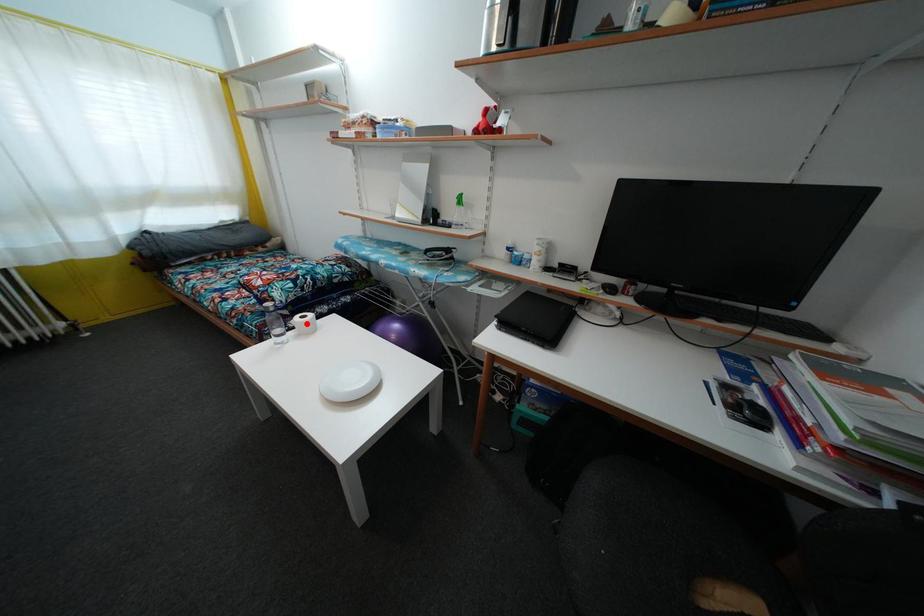
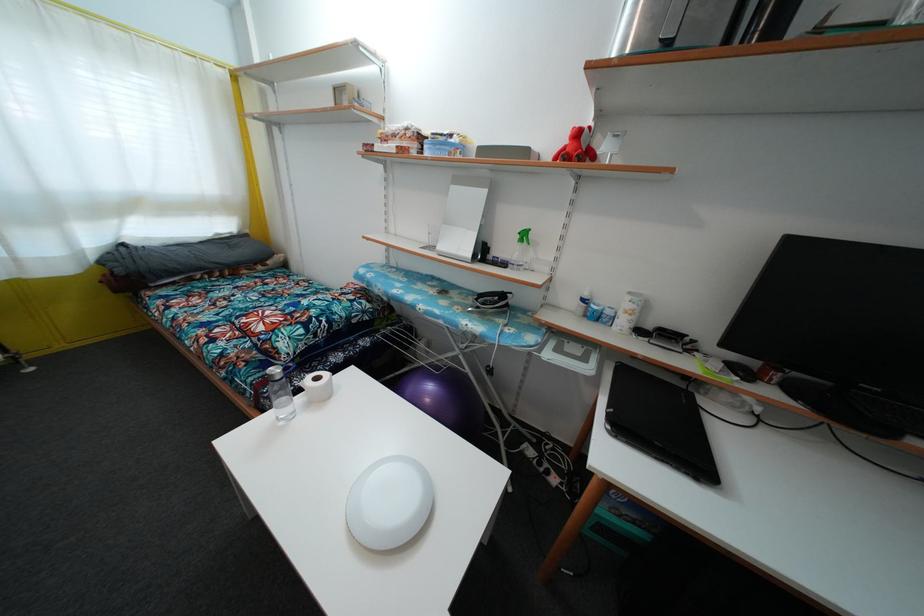
In the second image, find the point that corresponds to the highlighted location in the first image.

(321, 386)